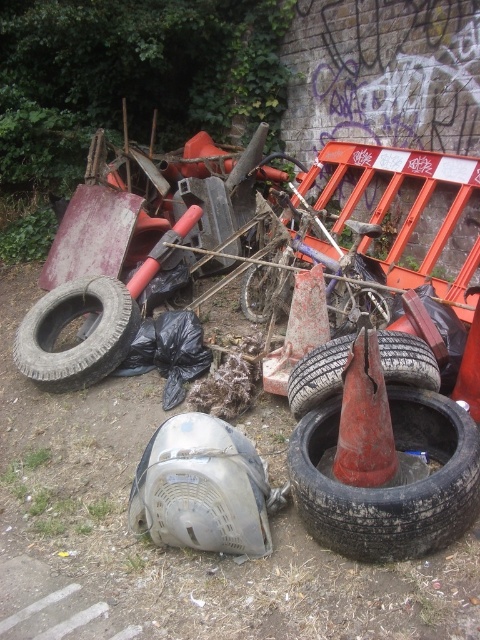
Who is more distant from viewer, (320, 339) or (255, 272)?

The point (255, 272) is behind.

Between orange rubber traffic cone at center and rubber tire at center, which one is positioned higher?

Positioned higher is rubber tire at center.

Where is `orange rubber traffic cone at center`? The width and height of the screenshot is (480, 640). orange rubber traffic cone at center is located at coordinates (299, 330).

Does point (130, 339) come behind point (469, 362)?

Yes, it is behind point (469, 362).

Can you confirm if gray rubber tire at lower left is positioned above smooth orange traffic cone at center?

Yes, gray rubber tire at lower left is above smooth orange traffic cone at center.

Which is in front, point (107, 342) or point (456, 397)?

Positioned in front is point (456, 397).

Where is `gray rubber tire at lower left`? gray rubber tire at lower left is located at coordinates (81, 339).

Does gray rubber tire at lower left appear on the right side of flat black tire at lower right?

No, gray rubber tire at lower left is not to the right of flat black tire at lower right.

Which is more to the left, gray rubber tire at lower left or flat black tire at lower right?

gray rubber tire at lower left is more to the left.

What do you see at coordinates (81, 339) in the screenshot? I see `gray rubber tire at lower left` at bounding box center [81, 339].

In order to click on gray rubber tire at lower left in this screenshot , I will do `click(81, 339)`.